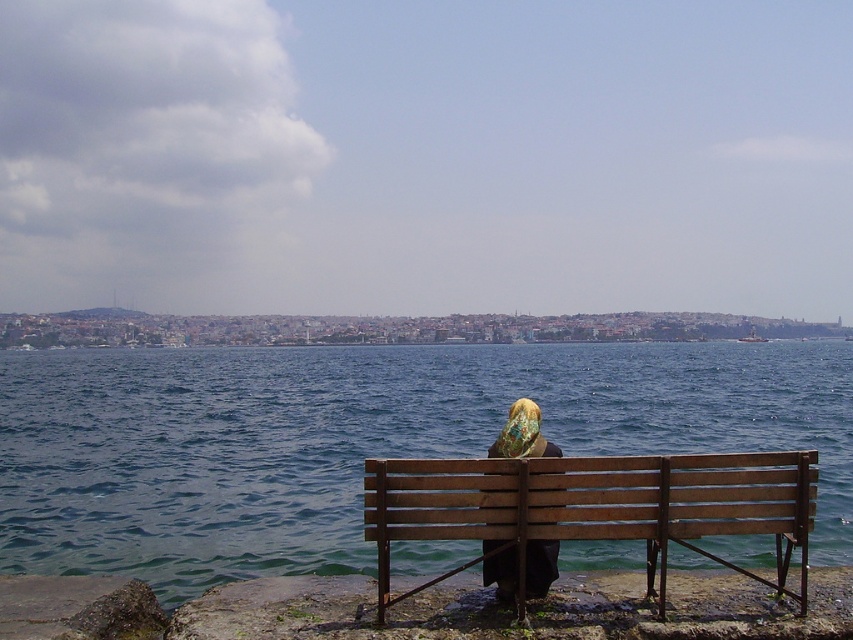
You are standing at the wooden bench at lower center and want to look at the blue water at center. In which direction should you turn your head?

You should turn your head to the right to look at the blue water at center, as it is located to the right of the wooden bench at lower center.

You are a photographer standing at the waterfront scene. You want to capture a photo where the wooden bench at lower center and the matte black headscarf at center are both in focus. Since you can only focus on one plane, which object should you focus on to ensure both are sharp?

You should focus on the wooden bench at lower center because it is closer to the viewer than the matte black headscarf at center. By focusing on the closer object, the farther object will still be within the depth of field, ensuring both are sharp.

You are standing at the point marked by the coordinate point at center. Looking towards the blue water at center, which direction would you face? The blue water at center is located at point (x=358, y=440).

The blue water at center is located at point (x=358, y=440), so facing the blue water at center would mean looking directly ahead since you are already at the point marked by the coordinate point at center.